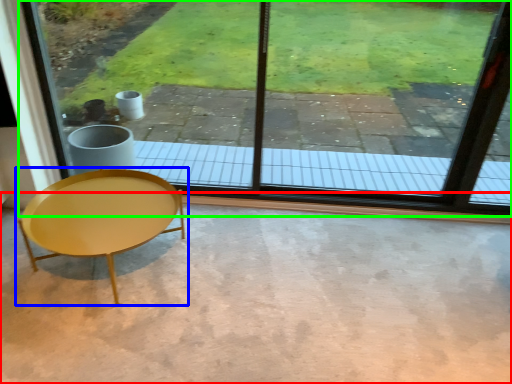
Question: Which object is the closest to the concrete (highlighted by a red box)? Choose among these: coffee table (highlighted by a blue box) or window (highlighted by a green box).

Choices:
 (A) coffee table
 (B) window

Answer: (A)